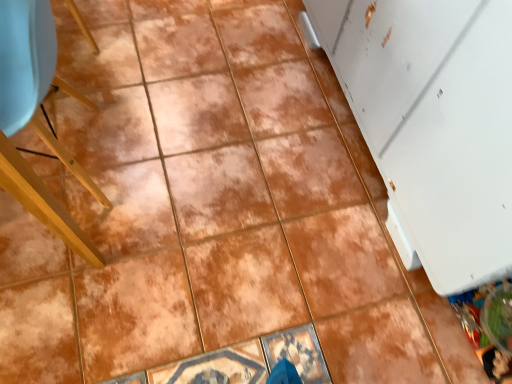
Question: Can you confirm if matte yellow chair at left is thinner than white matte refrigerator at right?

Choices:
 (A) yes
 (B) no

Answer: (A)

Question: Is matte yellow chair at left outside of white matte refrigerator at right?

Choices:
 (A) no
 (B) yes

Answer: (B)

Question: Considering the relative sizes of matte yellow chair at left and white matte refrigerator at right in the image provided, is matte yellow chair at left smaller than white matte refrigerator at right?

Choices:
 (A) yes
 (B) no

Answer: (A)

Question: Is matte yellow chair at left shorter than white matte refrigerator at right?

Choices:
 (A) no
 (B) yes

Answer: (B)

Question: Could white matte refrigerator at right be considered to be inside matte yellow chair at left?

Choices:
 (A) yes
 (B) no

Answer: (B)

Question: Are matte yellow chair at left and white matte refrigerator at right beside each other?

Choices:
 (A) no
 (B) yes

Answer: (A)

Question: Could matte yellow chair at left be considered to be inside white matte refrigerator at right?

Choices:
 (A) no
 (B) yes

Answer: (A)

Question: From a real-world perspective, is white matte refrigerator at right located beneath matte yellow chair at left?

Choices:
 (A) yes
 (B) no

Answer: (B)

Question: Is white matte refrigerator at right taller than matte yellow chair at left?

Choices:
 (A) yes
 (B) no

Answer: (A)

Question: Is white matte refrigerator at right not inside matte yellow chair at left?

Choices:
 (A) no
 (B) yes

Answer: (B)

Question: Is white matte refrigerator at right smaller than matte yellow chair at left?

Choices:
 (A) yes
 (B) no

Answer: (B)

Question: Is white matte refrigerator at right closer to the viewer compared to matte yellow chair at left?

Choices:
 (A) no
 (B) yes

Answer: (B)

Question: From a real-world perspective, relative to matte yellow chair at left, is white matte refrigerator at right vertically above or below?

Choices:
 (A) below
 (B) above

Answer: (B)